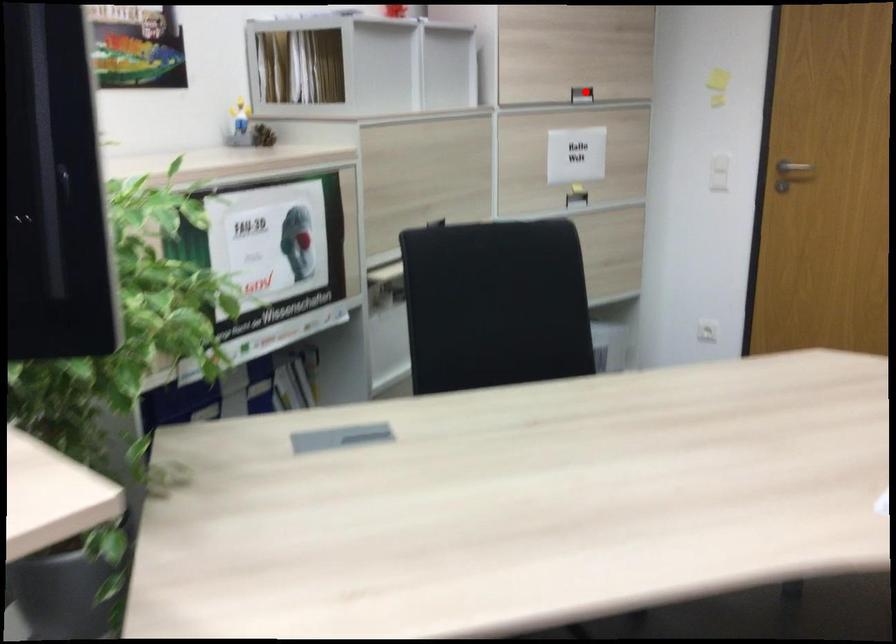
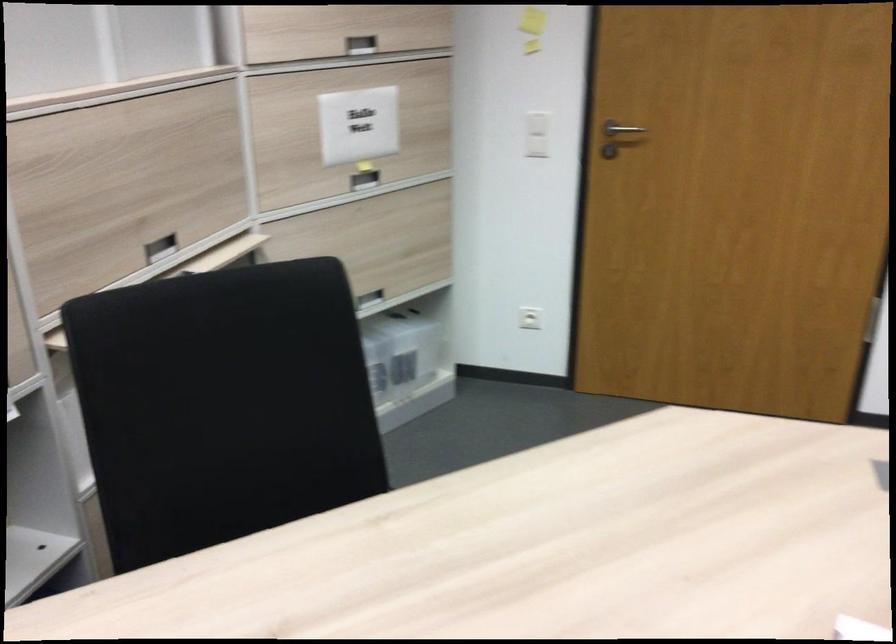
Question: I am providing you with two images of the same scene from different viewpoints. Image1 has a red point marked. In image2, the corresponding 3D location appears at what relative position? Reply with the corresponding letter.

Choices:
 (A) Closer
 (B) Farther

Answer: (A)